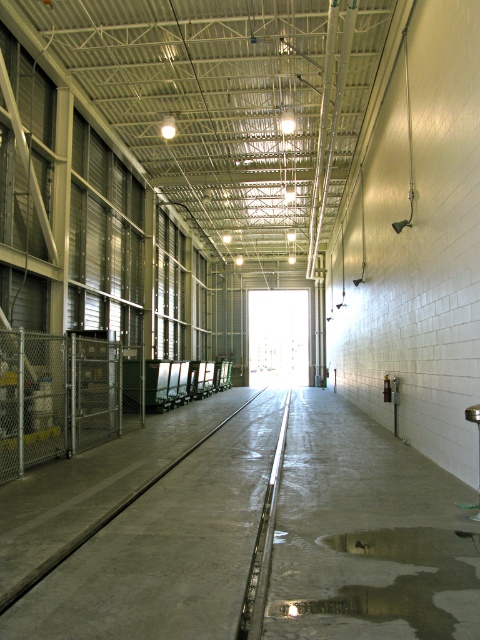
From the picture: You are standing in the rail yard and need to reach a tool box placed 4 meters away from you. There is a gray concrete rail at center between you and the toolbox. Can you walk around the rail to reach the toolbox?

The gray concrete rail at center is 3.72 meters from viewer, so since the rail is only 3.72 meters away and the toolbox is 4 meters away, you can walk around the rail to reach the toolbox as the distance is manageable.